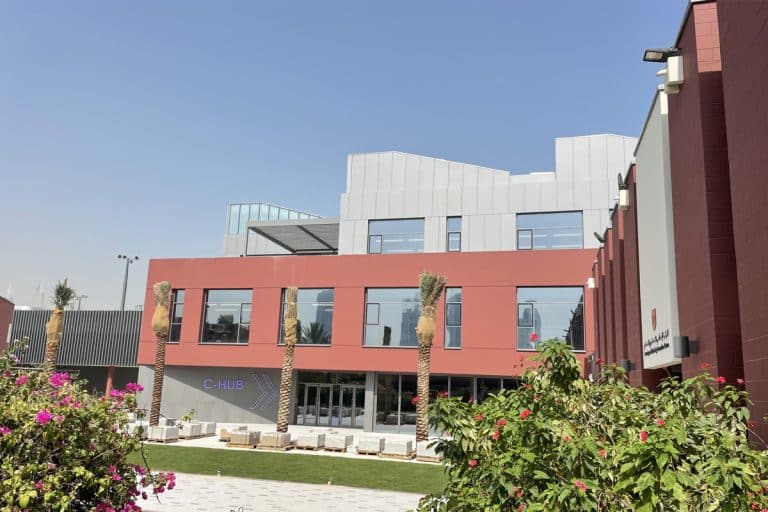
This screenshot has width=768, height=512. Identify the location of square windows. (224, 325), (310, 319), (389, 320), (550, 316), (561, 237), (406, 234).